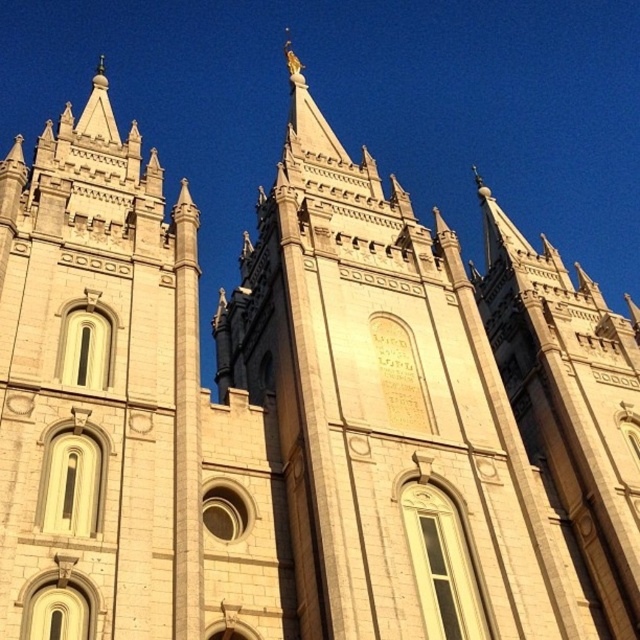
Can you confirm if white stone tower at center is taller than beige stone tower at right?

Correct, white stone tower at center is much taller as beige stone tower at right.

Who is higher up, white stone tower at center or beige stone tower at right?

white stone tower at center is higher up.

Does point (77, 275) come behind point (582, 520)?

No.

The image size is (640, 640). I want to click on white stone tower at center, so click(97, 388).